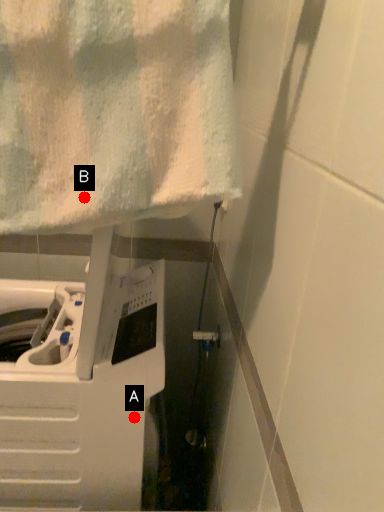
Question: Two points are circled on the image, labeled by A and B beside each circle. Which point is closer to the camera?

Choices:
 (A) A is closer
 (B) B is closer

Answer: (B)